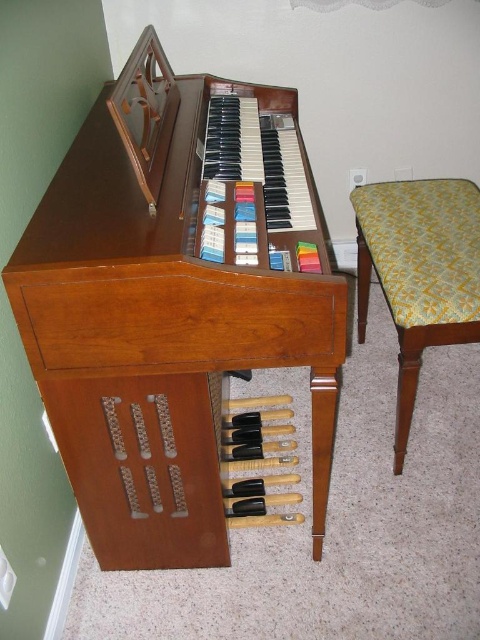
You are standing in a room with a wooden piano at center. If you face the piano, where would you find the pedalboard relative to the keyboard section?

The pedalboard is located below the keyboard section of the wooden piano at center.

You are standing in front of the vintage organ and want to reach both the point at coordinates point (136, 502) and point (427, 321). Which point should you reach first to touch them in order from closest to farthest?

You should first reach point (136, 502) because it is closer to you than point (427, 321), which is further away.